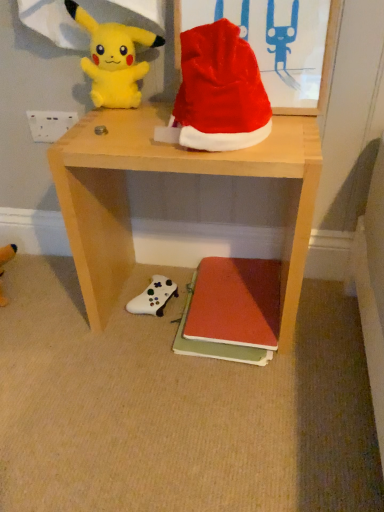
I want to click on free point in front of white matte game controller at lower center, which ranks as the first toy in bottom-to-top order, so (x=146, y=345).